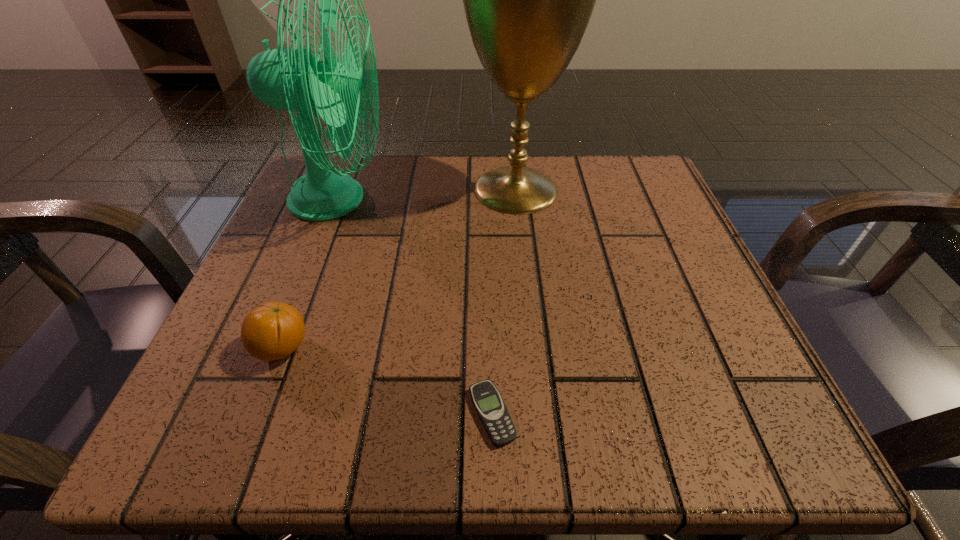
Where is `free space between the shortest object and the second nearest object`? The height and width of the screenshot is (540, 960). free space between the shortest object and the second nearest object is located at coordinates (387, 381).

This screenshot has width=960, height=540. Find the location of `free space between the fan and the orange`. free space between the fan and the orange is located at coordinates (310, 274).

At what (x,y) coordinates should I click in order to perform the action: click on free space that is in between the beeper and the third farthest object. Please return your answer as a coordinate pair (x, y). This screenshot has width=960, height=540. Looking at the image, I should click on (387, 381).

Locate an element on the screen. This screenshot has height=540, width=960. empty location between the third tallest object and the trophy cup is located at coordinates (399, 269).

Locate an element on the screen. The height and width of the screenshot is (540, 960). the second closest object to the nearest object is located at coordinates (291, 79).

The width and height of the screenshot is (960, 540). Find the location of `the third closest object relative to the second shortest object`. the third closest object relative to the second shortest object is located at coordinates (528, 0).

The height and width of the screenshot is (540, 960). What are the coordinates of `vacant space that satisfies the following two spatial constraints: 1. in front of the fan to blow air; 2. on the left side of the nearest object` in the screenshot? It's located at (253, 414).

Find the location of a particular element. The image size is (960, 540). vacant space that satisfies the following two spatial constraints: 1. on the back side of the nearest object; 2. in front of the fan to blow air is located at coordinates (488, 199).

Where is `vacant region that satisfies the following two spatial constraints: 1. on the back side of the second nearest object; 2. in front of the fan to blow air`? vacant region that satisfies the following two spatial constraints: 1. on the back side of the second nearest object; 2. in front of the fan to blow air is located at coordinates (340, 199).

Locate an element on the screen. This screenshot has width=960, height=540. vacant space that satisfies the following two spatial constraints: 1. in front of the fan to blow air; 2. on the back side of the third tallest object is located at coordinates (279, 348).